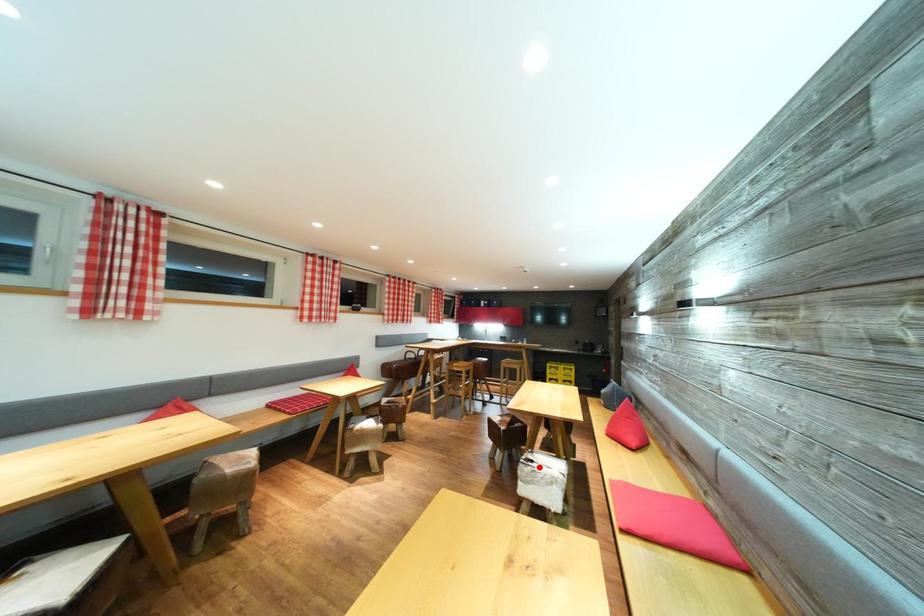
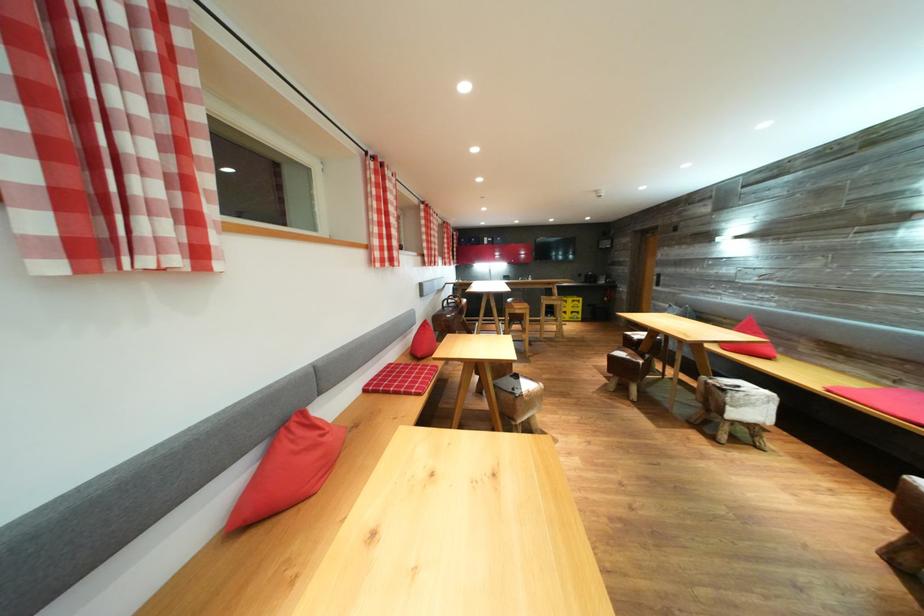
Question: I am providing you with two images of the same scene from different viewpoints. Image1 has a red point marked. In image2, the corresponding 3D location appears at what relative position? Reply with the corresponding letter.

Choices:
 (A) Closer
 (B) Farther

Answer: (B)